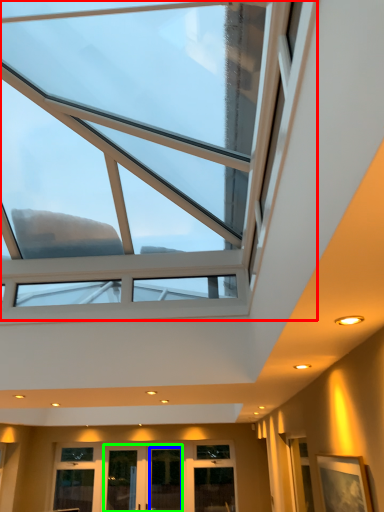
Question: Considering the real-world distances, which object is closest to window (highlighted by a red box)? glass door (highlighted by a blue box) or glass door (highlighted by a green box).

Choices:
 (A) glass door
 (B) glass door

Answer: (B)